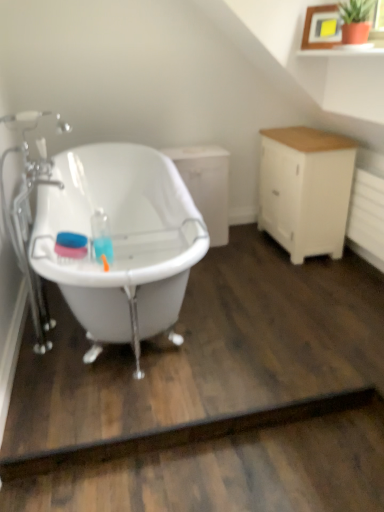
Question: Considering the relative positions of white matte cabinet at center, which ranks as the 1th cabinetry in left-to-right order, and white wood cabinet at right, the first cabinetry viewed from the right, in the image provided, is white matte cabinet at center, which ranks as the 1th cabinetry in left-to-right order, to the left or to the right of white wood cabinet at right, the first cabinetry viewed from the right,?

Choices:
 (A) right
 (B) left

Answer: (B)

Question: Considering the positions of white matte cabinet at center, positioned as the 2th cabinetry in right-to-left order, and white wood cabinet at right, marked as the 2th cabinetry in a left-to-right arrangement, in the image, is white matte cabinet at center, positioned as the 2th cabinetry in right-to-left order, bigger or smaller than white wood cabinet at right, marked as the 2th cabinetry in a left-to-right arrangement,?

Choices:
 (A) small
 (B) big

Answer: (A)

Question: Estimate the real-world distances between objects in this image. Which object is closer to the white wood cabinet at right, the first cabinetry viewed from the right?

Choices:
 (A) white glossy bathtub at left
 (B) white matte cabinet at center, which ranks as the 1th cabinetry in left-to-right order
 (C) dark brown wood at lower center

Answer: (B)

Question: Which object is the farthest from the dark brown wood at lower center?

Choices:
 (A) white wood cabinet at right, the first cabinetry viewed from the right
 (B) white matte cabinet at center, positioned as the 2th cabinetry in right-to-left order
 (C) white glossy bathtub at left

Answer: (B)